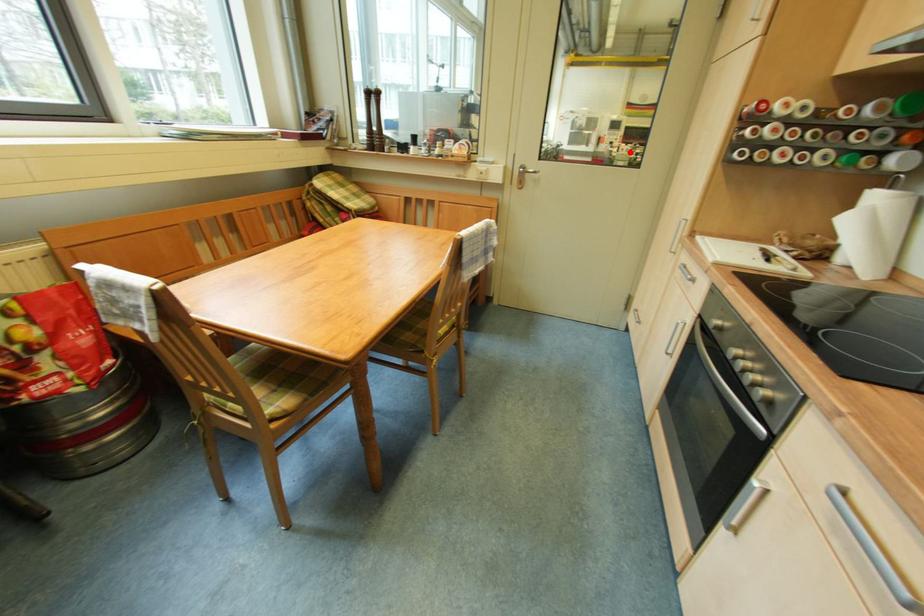
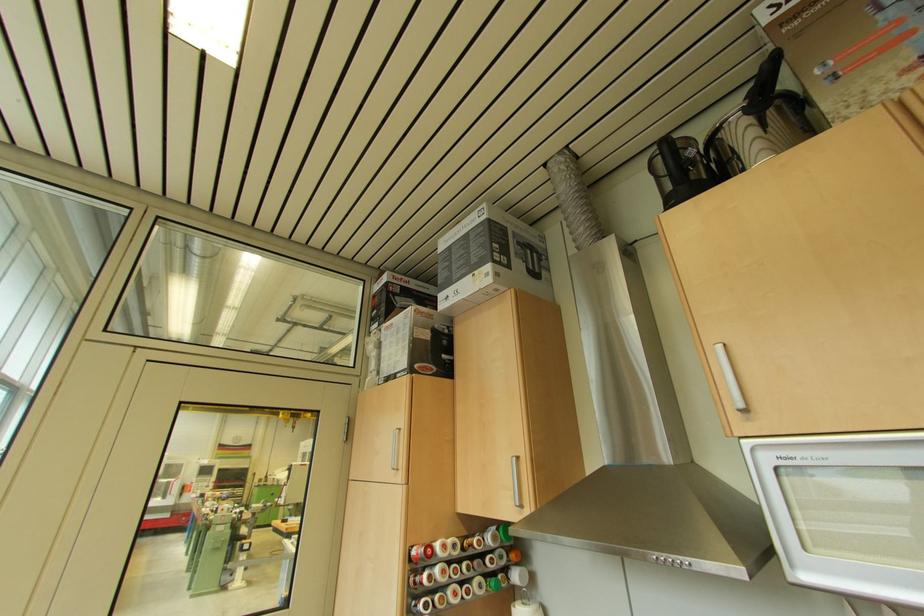
Question: I am providing you with two images of the same scene from different viewpoints. In image1, a red point is highlighted. Considering the same 3D point in image2, which of the following is correct?

Choices:
 (A) It is closer
 (B) It is farther

Answer: (B)